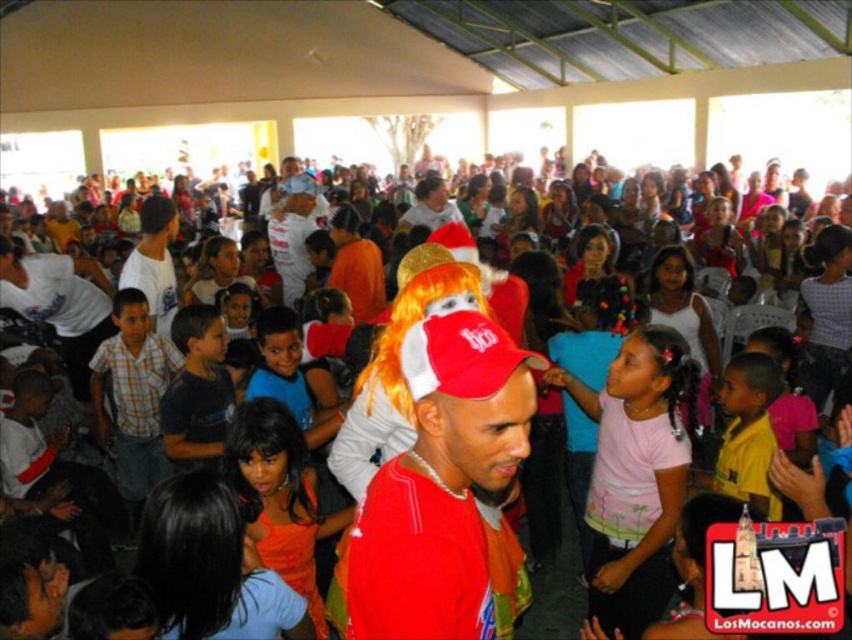
Can you confirm if white cotton shirt at center is smaller than matte gold wig at center?

Incorrect, white cotton shirt at center is not smaller in size than matte gold wig at center.

The image size is (852, 640). I want to click on white cotton shirt at center, so click(x=292, y=234).

Can you confirm if pink cotton shirt at center is taller than yellow shirt at right?

Yes, pink cotton shirt at center is taller than yellow shirt at right.

The image size is (852, 640). What do you see at coordinates (635, 476) in the screenshot?
I see `pink cotton shirt at center` at bounding box center [635, 476].

This screenshot has width=852, height=640. What do you see at coordinates (635, 476) in the screenshot? I see `pink cotton shirt at center` at bounding box center [635, 476].

Find the location of a particular element. Image resolution: width=852 pixels, height=640 pixels. pink cotton shirt at center is located at coordinates (635, 476).

Which of these two, dark blue t-shirt at center or white cotton shirt at center, stands taller?

white cotton shirt at center

Who is more distant from viewer, (217,444) or (280,186)?

The point (280,186) is behind.

Where is `dark blue t-shirt at center`? dark blue t-shirt at center is located at coordinates (196, 388).